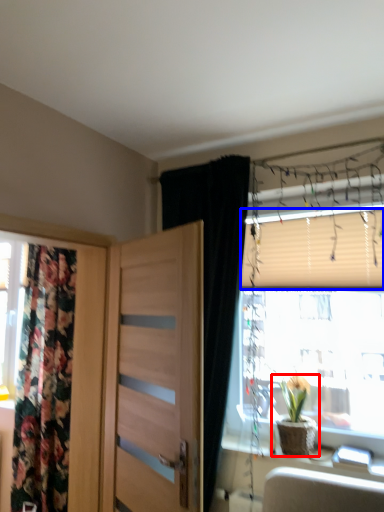
Question: Among these objects, which one is nearest to the camera, houseplant (highlighted by a red box) or blind (highlighted by a blue box)?

Choices:
 (A) houseplant
 (B) blind

Answer: (A)